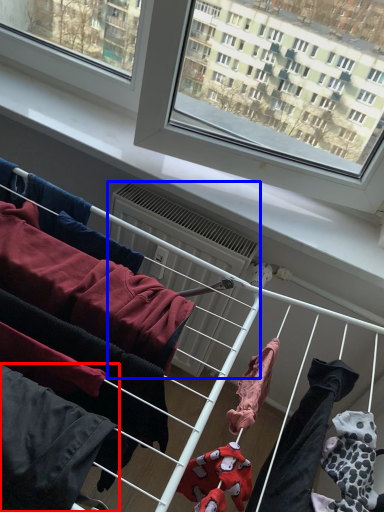
Question: Which object appears closest to the camera in this image, clothing (highlighted by a red box) or air conditioner (highlighted by a blue box)?

Choices:
 (A) clothing
 (B) air conditioner

Answer: (A)